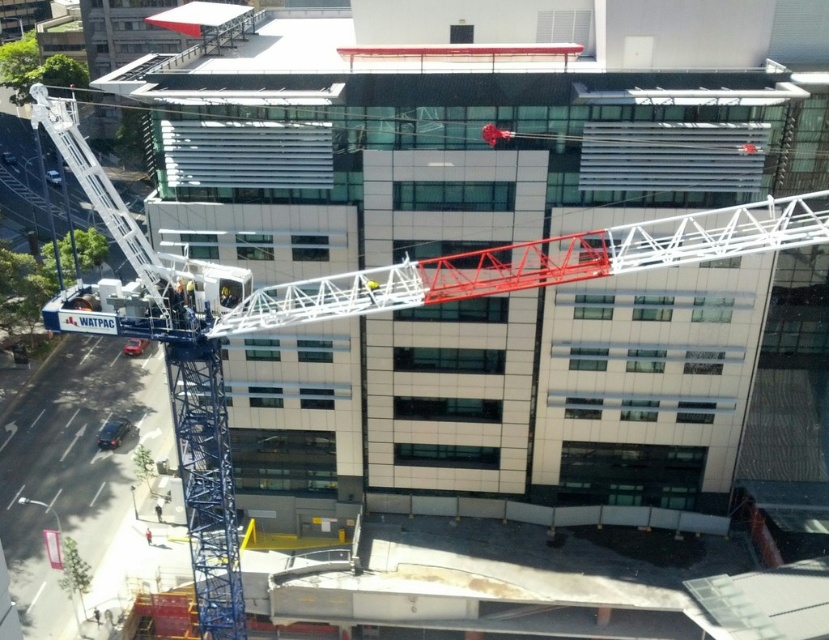
Question: Among these objects, which one is nearest to the camera?

Choices:
 (A) yellow fabric construction worker at center
 (B) red shirt at center
 (C) white metallic ladder at left

Answer: (C)

Question: Can you confirm if white metallic ladder at left is smaller than red shirt at center?

Choices:
 (A) no
 (B) yes

Answer: (A)

Question: Does yellow fabric construction worker at center appear over red shirt at center?

Choices:
 (A) yes
 (B) no

Answer: (A)

Question: Which of the following is the farthest from the observer?

Choices:
 (A) red shirt at center
 (B) yellow fabric construction worker at center
 (C) white metallic ladder at left

Answer: (A)

Question: Observing the image, what is the correct spatial positioning of white metallic ladder at left in reference to yellow fabric construction worker at center?

Choices:
 (A) below
 (B) above

Answer: (B)

Question: Which object appears farthest from the camera in this image?

Choices:
 (A) red shirt at center
 (B) white metallic ladder at left

Answer: (A)